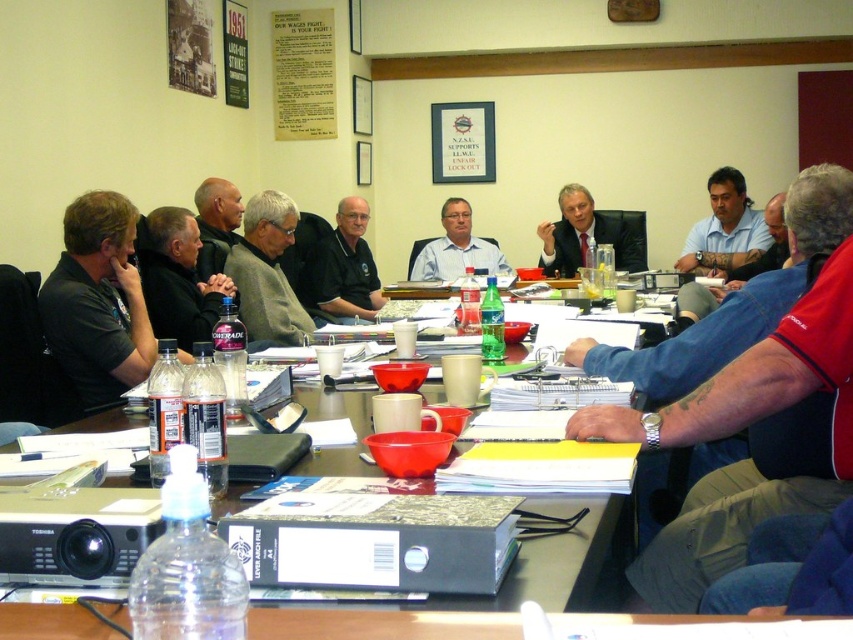
Consider the image. You are standing at the conference table and want to reach both the point at coordinates [633,547] and the point at coordinates [616,230]. Which point will require you to move further away from your current position?

The point at coordinates [616,230] will require moving further away because it is farther from the camera compared to the point at [633,547], which is closer.

You are standing in front of the conference table and want to reach both the point at coordinates (x=219, y=276) and the point at coordinates (x=273, y=221). Which point should you reach for first to minimize the distance walked?

You should reach for the point at coordinates (x=219, y=276) first because it is closer to you than the point at coordinates (x=273, y=221).

You are a new attendee entering the meeting room and see the black matte shirt at left and the gray sweater at center. Which person should you approach first if you want to speak to the one closer to the front of the room?

The black matte shirt at left is closer to the front of the room, so you should approach them first.